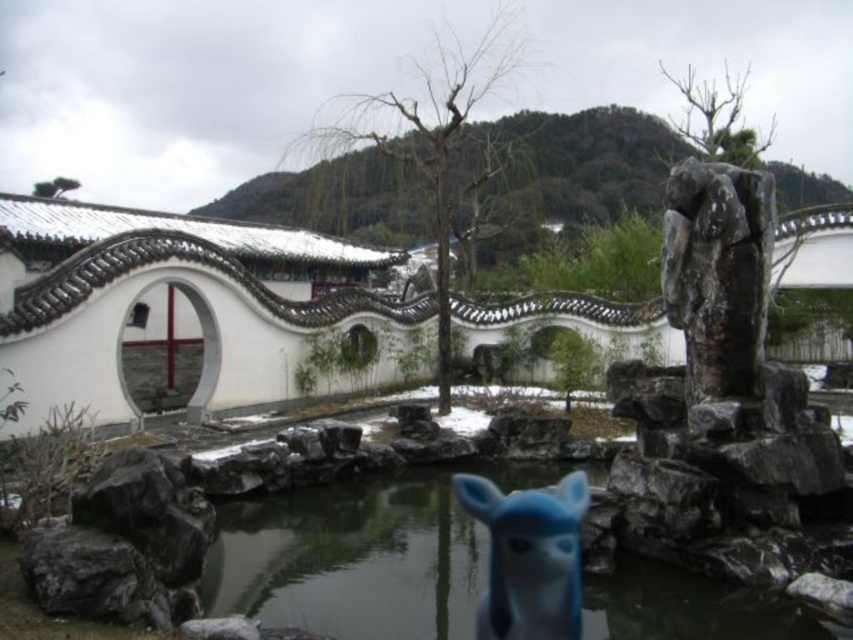
You are a visitor in the garden and want to take a photo of the blue rubber animal at center without the rough stone statue at right appearing in the frame. How should you adjust your camera angle?

Lower your camera angle so that the blue rubber animal at center is visible while the rough stone statue at right, which is positioned above it, is out of the frame.

From the picture: You are standing in the East Asian garden scene. You see two points marked in the image. The first point is at coordinate point (375, 570) and the second is at coordinate point (669, 308). Which point is closer to you?

Point (375, 570) is in front of point (669, 308), so the first point is closer to you.